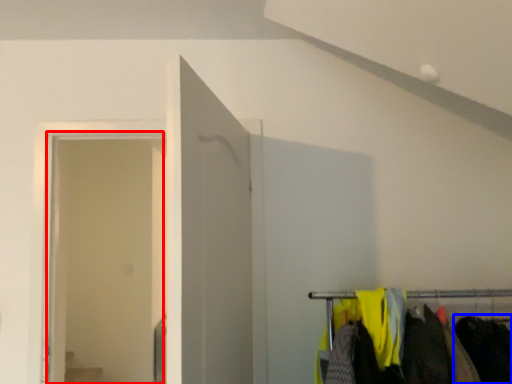
Question: Which object appears farthest to the camera in this image, glass door (highlighted by a red box) or clothing (highlighted by a blue box)?

Choices:
 (A) glass door
 (B) clothing

Answer: (A)